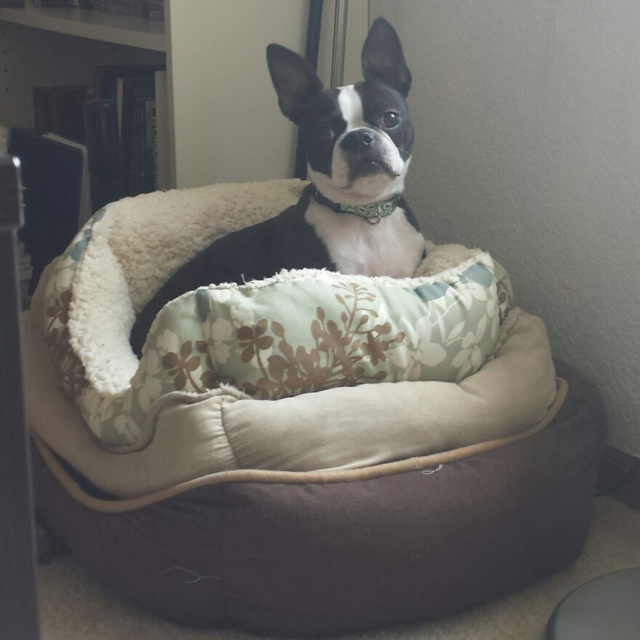
Question: Which point is farther from the camera taking this photo?

Choices:
 (A) (404, 72)
 (B) (24, 86)
 (C) (504, 520)

Answer: (B)

Question: Among these points, which one is farthest from the camera?

Choices:
 (A) (84, 240)
 (B) (195, 80)
 (C) (291, 211)

Answer: (B)

Question: Is wooden bookshelf at upper left wider than black and white fur at center?

Choices:
 (A) no
 (B) yes

Answer: (B)

Question: Among these objects, which one is farthest from the camera?

Choices:
 (A) wooden bookshelf at upper left
 (B) fluffy beige dog bed at center

Answer: (A)

Question: Is wooden bookshelf at upper left further to the viewer compared to black and white fur at center?

Choices:
 (A) no
 (B) yes

Answer: (B)

Question: Does fluffy beige dog bed at center appear on the right side of black and white fur at center?

Choices:
 (A) no
 (B) yes

Answer: (B)